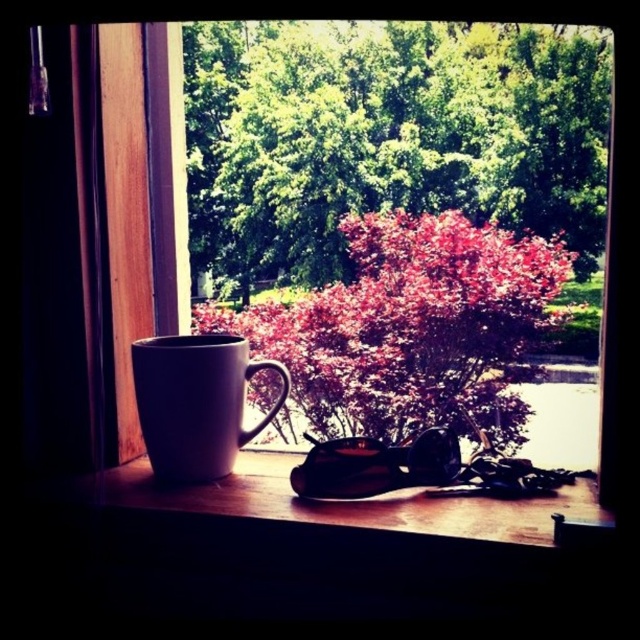
Question: Among these points, which one is nearest to the camera?

Choices:
 (A) (488, 525)
 (B) (502, 410)
 (C) (428, 189)
 (D) (186, 352)

Answer: (A)

Question: Is wooden at lower center to the left of white matte mug at left from the viewer's perspective?

Choices:
 (A) no
 (B) yes

Answer: (A)

Question: Considering the real-world distances, which object is farthest from the white matte mug at left?

Choices:
 (A) matte red bush at center
 (B) green leafy tree at upper center
 (C) wooden at lower center

Answer: (B)

Question: Considering the real-world distances, which object is farthest from the matte red bush at center?

Choices:
 (A) wooden at lower center
 (B) green leafy tree at upper center

Answer: (A)

Question: Considering the relative positions of matte red bush at center and wooden at lower center in the image provided, where is matte red bush at center located with respect to wooden at lower center?

Choices:
 (A) right
 (B) left

Answer: (A)

Question: Is matte red bush at center closer to the viewer compared to white matte mug at left?

Choices:
 (A) no
 (B) yes

Answer: (A)